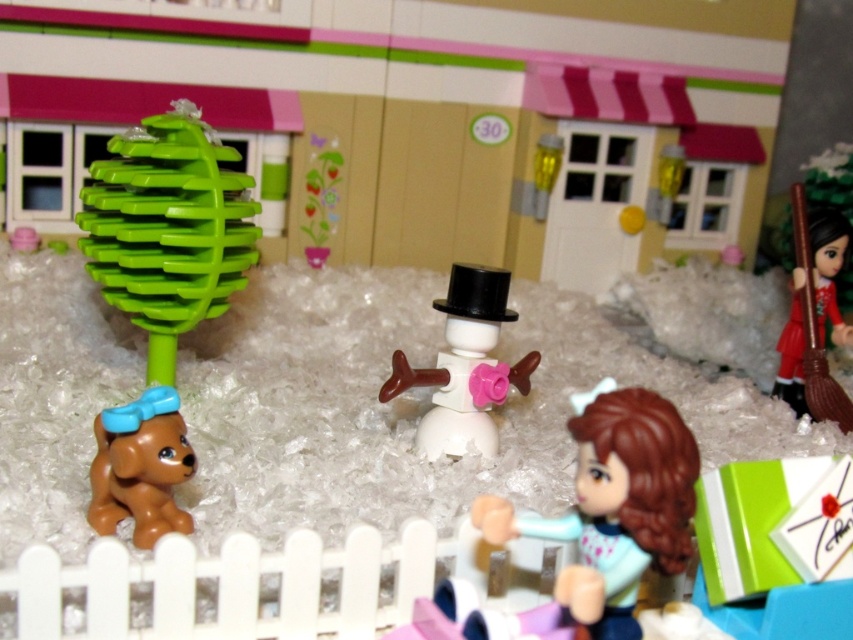
Looking at this image, can you confirm if white matte snowman at center is wider than red fabric doll at right?

Yes.

Is white matte snowman at center shorter than red fabric doll at right?

Yes.

Who is more distant from viewer, (457, 353) or (819, 397)?

Point (819, 397)

Where is `white matte snowman at center`? white matte snowman at center is located at coordinates (463, 365).

Who is taller, white matte snowman at center or brown glossy dog at lower left?

With more height is white matte snowman at center.

Can you confirm if white matte snowman at center is positioned below brown glossy dog at lower left?

Actually, white matte snowman at center is above brown glossy dog at lower left.

Identify the location of white matte snowman at center. (463, 365).

Locate an element on the screen. Image resolution: width=853 pixels, height=640 pixels. white matte snowman at center is located at coordinates (463, 365).

Between green plastic ball at upper left and smooth brown hair at lower right, which one has more height?

green plastic ball at upper left is taller.

Is point (238, 280) positioned in front of point (589, 604)?

No, (238, 280) is behind (589, 604).

Where is `green plastic ball at upper left`? Image resolution: width=853 pixels, height=640 pixels. green plastic ball at upper left is located at coordinates (167, 228).